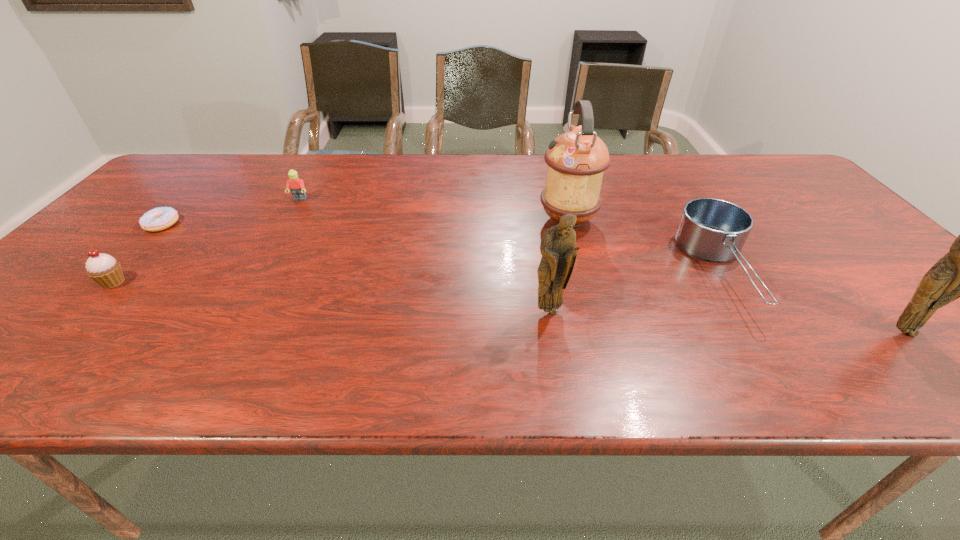
The width and height of the screenshot is (960, 540). Identify the location of the left figurine. (557, 247).

In order to click on the third tallest object in this screenshot , I will do `click(557, 247)`.

You are a GUI agent. You are given a task and a screenshot of the screen. Output one action in this format:
    pyautogui.click(x=<x>, y=<y>)
    Task: Click on the rightmost object
    
    Given the screenshot: What is the action you would take?
    pyautogui.click(x=959, y=274)

Find the location of a particular element. Image resolution: width=960 pixels, height=540 pixels. the nearer figurine is located at coordinates (959, 274).

Image resolution: width=960 pixels, height=540 pixels. What are the coordinates of `Lego` in the screenshot? It's located at (296, 184).

The image size is (960, 540). Find the location of `the fifth object from right to left`. the fifth object from right to left is located at coordinates (296, 184).

The width and height of the screenshot is (960, 540). I want to click on oil lamp, so click(576, 160).

Identify the location of cupcake. (106, 271).

Identify the location of doughnut. (160, 218).

Locate an element on the screen. Image resolution: width=960 pixels, height=540 pixels. saucepan is located at coordinates (714, 230).